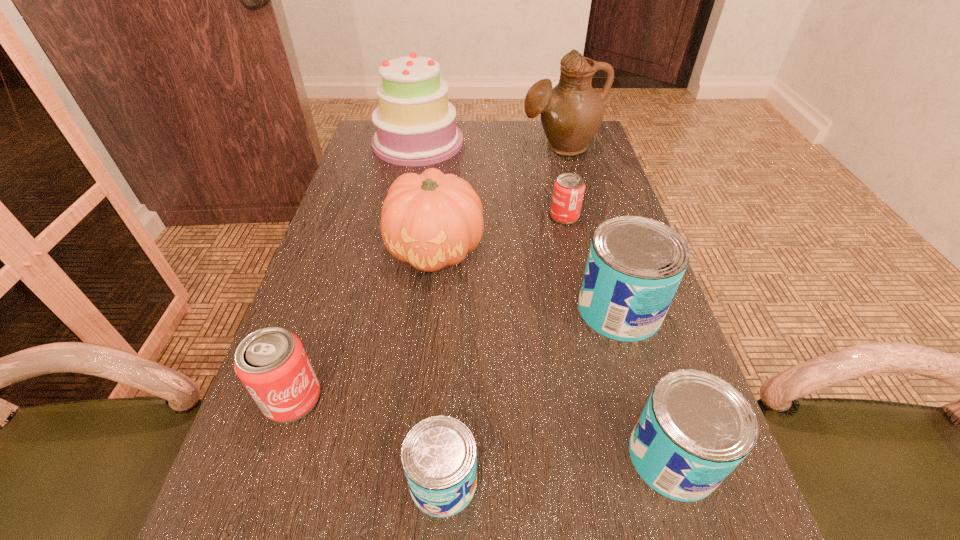
You are a GUI agent. You are given a task and a screenshot of the screen. Output one action in this format:
    pyautogui.click(x=<x>, y=<y>)
    Task: Click on the farthest can
    
    Given the screenshot: What is the action you would take?
    pyautogui.click(x=568, y=193)

Find the location of a particular element. the right red can is located at coordinates (568, 193).

At what (x,y) coordinates should I click in order to perform the action: click on free location located at the spout of the pitcher. Please return your answer as a coordinate pair (x, y). This screenshot has height=540, width=960. Looking at the image, I should click on (570, 183).

Identify the location of vacant point located 0.100m on the right of the cake. (494, 143).

In order to click on vacant space located 0.150m on the carved face of the pumpkin in this screenshot , I will do `click(426, 341)`.

What are the coordinates of `blank space located on the left of the biggest blue can` in the screenshot? It's located at (463, 310).

Locate an element on the screen. The width and height of the screenshot is (960, 540). free space located 0.170m on the back of the bigger red can is located at coordinates (324, 303).

Find the location of a particular element. free location located 0.350m on the back of the second smallest blue can is located at coordinates (615, 272).

I want to click on vacant region located on the back of the leftmost blue can, so click(454, 287).

Find the location of a particular element. Image resolution: width=960 pixels, height=540 pixels. vacant point located 0.130m on the front of the smaller red can is located at coordinates (574, 260).